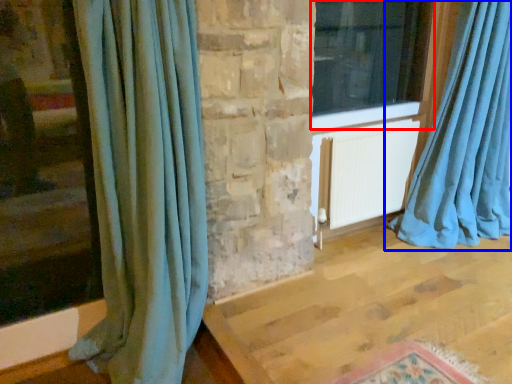
Question: Which object appears closest to the camera in this image, window (highlighted by a red box) or curtain (highlighted by a blue box)?

Choices:
 (A) window
 (B) curtain

Answer: (B)